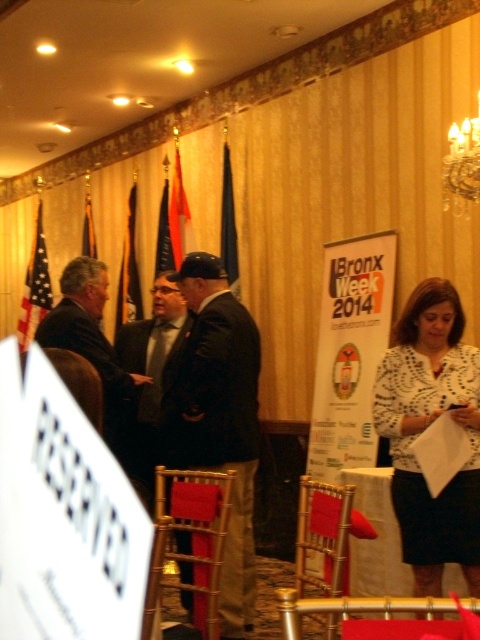
You are organizing seating arrangements for the event. You need to place a narrow decorative item between the metallic gold chair at center and the american flag at left. Which object should the item be placed closer to?

The narrow decorative item should be placed closer to the metallic gold chair at center because it is thinner than the american flag at left, requiring less space between them.

You are attending an event and see the gold wood chair at center and the blue fabric flag at upper center. Which object is located higher in the image?

The blue fabric flag at upper center is higher than the gold wood chair at center because it is positioned above it.

You are at the event and want to find a dark brown leather jacket at center. Where would you look relative to the point marked at coordinate (x=217, y=417)?

The dark brown leather jacket at center is located exactly at the point marked at coordinate (x=217, y=417).